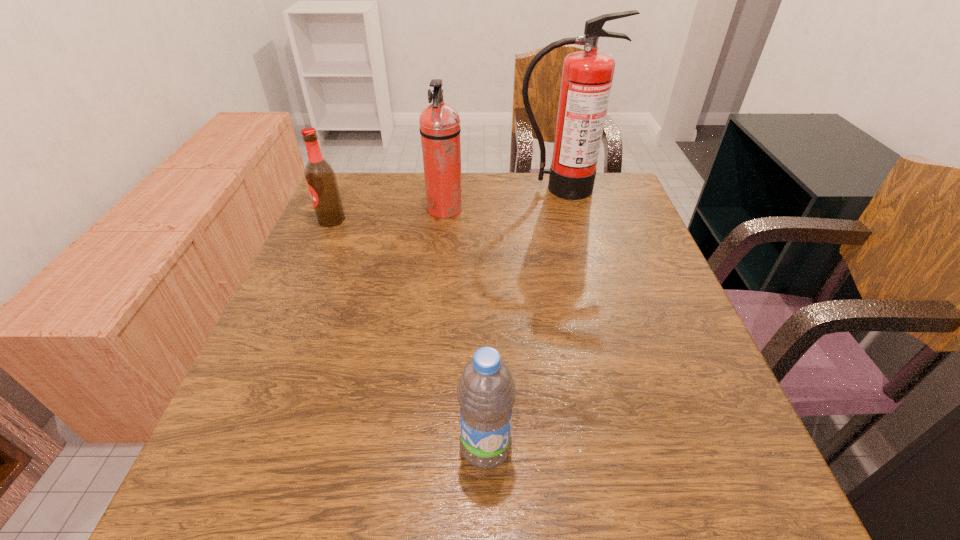
This screenshot has width=960, height=540. What are the coordinates of `vacant area at the right edge of the desktop` in the screenshot? It's located at (646, 388).

Where is `free space at the near left corner of the desktop`? Image resolution: width=960 pixels, height=540 pixels. free space at the near left corner of the desktop is located at coordinates (294, 473).

The height and width of the screenshot is (540, 960). Find the location of `free space at the far right corner`. free space at the far right corner is located at coordinates (593, 212).

Where is `free area in between the beer bottle and the second object from left to right`? This screenshot has height=540, width=960. free area in between the beer bottle and the second object from left to right is located at coordinates (388, 215).

Locate an element on the screen. This screenshot has height=540, width=960. empty location between the right fire extinguisher and the left fire extinguisher is located at coordinates (502, 199).

Locate an element on the screen. free point between the right fire extinguisher and the water bottle is located at coordinates (522, 318).

I want to click on vacant area between the nearest object and the leftmost object, so click(409, 334).

I want to click on free space that is in between the leftmost object and the nearest object, so click(409, 334).

In order to click on blank region between the second tallest object and the right fire extinguisher in this screenshot , I will do `click(502, 199)`.

Identify the location of unoccupied area between the right fire extinguisher and the nearest object. The width and height of the screenshot is (960, 540). (522, 318).